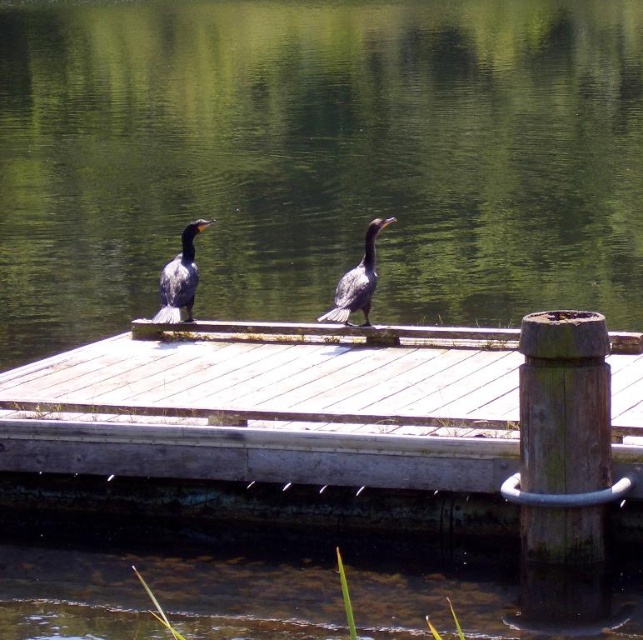
Question: Does green water at center appear under white wood dock at center?

Choices:
 (A) yes
 (B) no

Answer: (B)

Question: Is green water at center in front of gray matte bird at left?

Choices:
 (A) no
 (B) yes

Answer: (B)

Question: Among these points, which one is nearest to the camera?

Choices:
 (A) (194, 280)
 (B) (314, 500)

Answer: (B)

Question: Which of the following is the farthest from the observer?

Choices:
 (A) gray matte bird at center
 (B) green water at center

Answer: (A)

Question: Does gray matte bird at left appear under gray matte bird at center?

Choices:
 (A) yes
 (B) no

Answer: (B)

Question: Among these objects, which one is nearest to the camera?

Choices:
 (A) gray matte bird at center
 (B) gray matte bird at left
 (C) green water at center
 (D) white wood dock at center

Answer: (C)